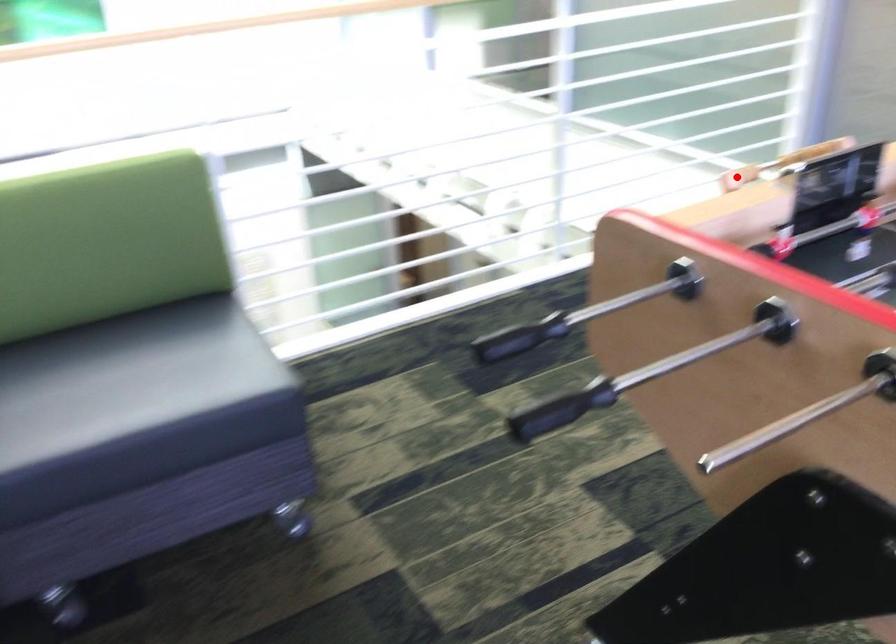
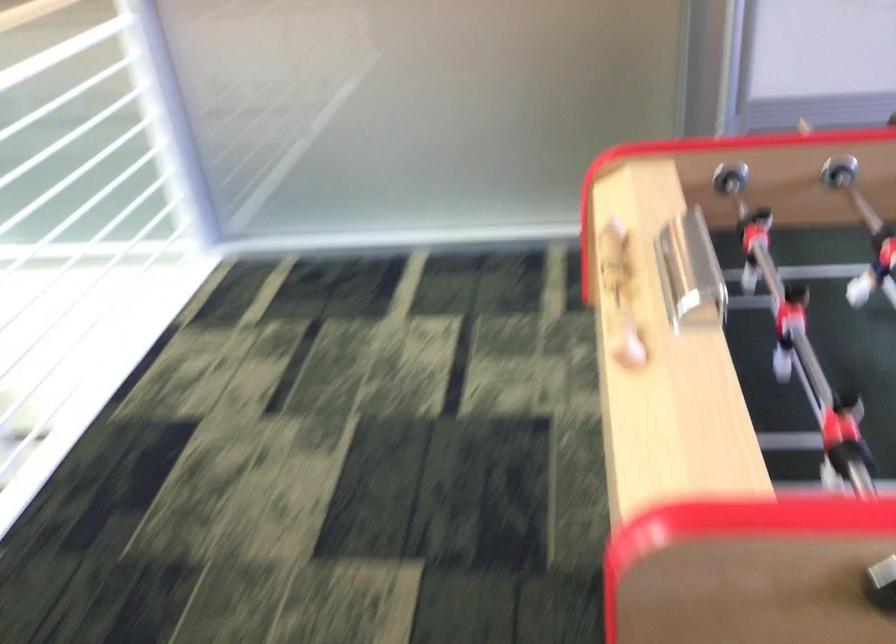
Find the pixel in the second image that matches the highlighted location in the first image.

(626, 343)